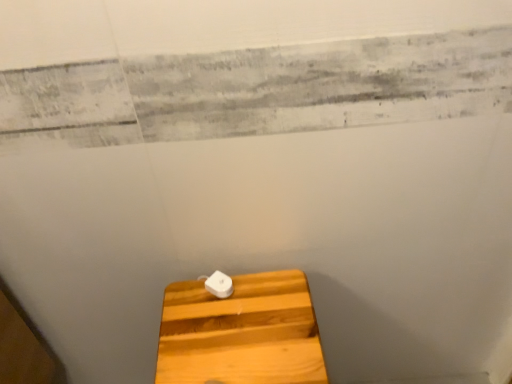
Describe the element at coordinates (241, 332) in the screenshot. I see `light wood cutting board at center` at that location.

Find the location of a particular element. The image size is (512, 384). light wood cutting board at center is located at coordinates (241, 332).

The width and height of the screenshot is (512, 384). I want to click on light wood cutting board at center, so click(241, 332).